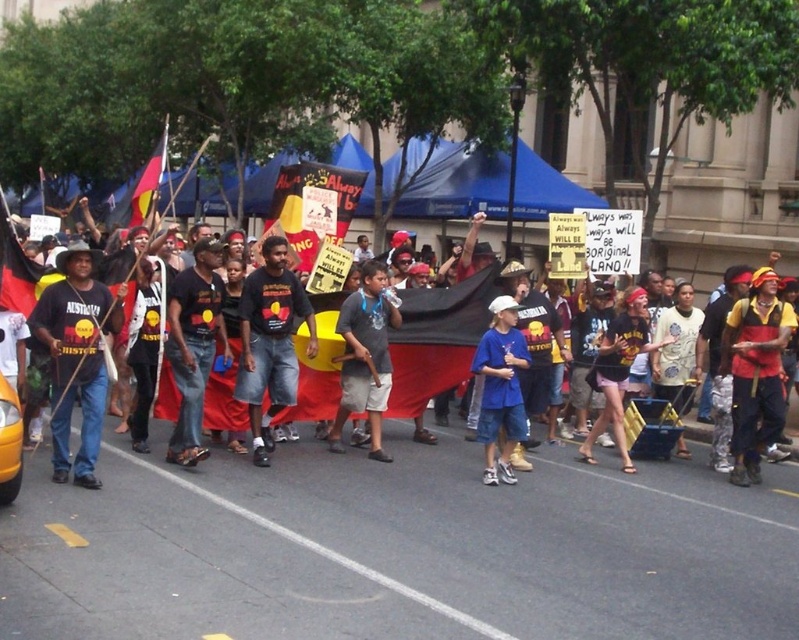
Is dark blue t-shirt at center to the left of dark blue jeans at center from the viewer's perspective?

Incorrect, dark blue t-shirt at center is not on the left side of dark blue jeans at center.

Between point (277, 266) and point (211, 310), which one is positioned behind?

The point (277, 266) is more distant.

Where is `dark blue t-shirt at center`? The image size is (799, 640). dark blue t-shirt at center is located at coordinates (269, 340).

Who is shorter, black t-shirt at center or matte black t-shirt at left?

black t-shirt at center is shorter.

This screenshot has height=640, width=799. In order to click on black t-shirt at center in this screenshot , I will do `click(436, 339)`.

Is matte black t-shirt at left positioned in front of gray cotton t-shirt at center?

Yes, matte black t-shirt at left is closer to the viewer.

Is matte black t-shirt at left positioned at the back of gray cotton t-shirt at center?

No, it is in front of gray cotton t-shirt at center.

Does point (32, 320) lie behind point (396, 316)?

That is False.

The width and height of the screenshot is (799, 640). I want to click on matte black t-shirt at left, so click(76, 356).